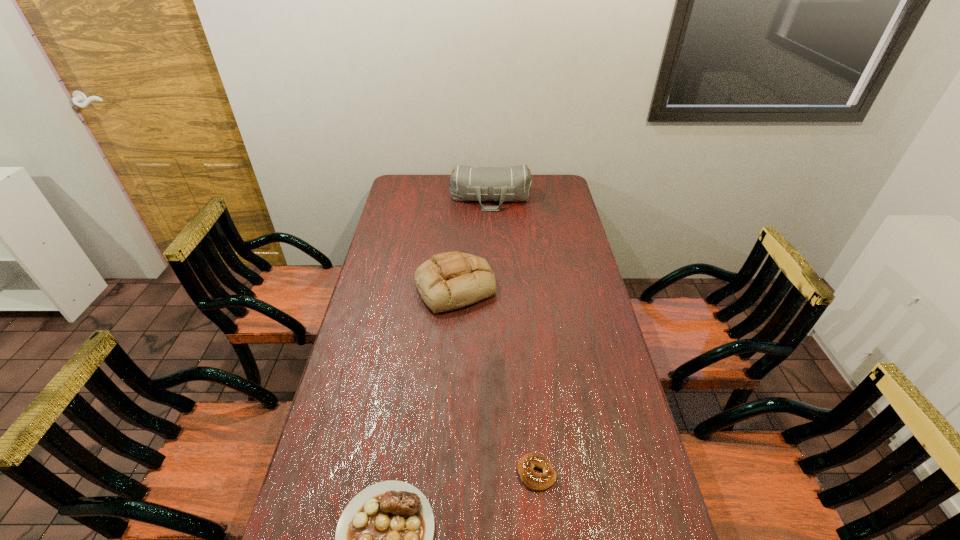
You are a GUI agent. You are given a task and a screenshot of the screen. Output one action in this format:
    pyautogui.click(x=<x>, y=<y>)
    Task: Click on the free region at the left edge
    
    Given the screenshot: What is the action you would take?
    pyautogui.click(x=393, y=309)

The image size is (960, 540). What are the coordinates of `vacant space at the right edge of the desktop` in the screenshot? It's located at (569, 260).

In the image, there is a desktop. Identify the location of vacant space at the far right corner. (555, 187).

Locate an element on the screen. This screenshot has height=540, width=960. free point between the duffel bag and the shortest object is located at coordinates (514, 336).

Where is `free space between the bread and the duffel bag`? The width and height of the screenshot is (960, 540). free space between the bread and the duffel bag is located at coordinates (473, 243).

At what (x,y) coordinates should I click in order to perform the action: click on vacant point located between the tallest object and the third nearest object. Please return your answer as a coordinate pair (x, y). The width and height of the screenshot is (960, 540). Looking at the image, I should click on (473, 243).

The height and width of the screenshot is (540, 960). What are the coordinates of `unoccupied position between the bagel and the farthest object` in the screenshot? It's located at (514, 336).

The width and height of the screenshot is (960, 540). What are the coordinates of `vacant region between the third shortest object and the farthest object` in the screenshot? It's located at (473, 243).

You are a GUI agent. You are given a task and a screenshot of the screen. Output one action in this format:
    pyautogui.click(x=<x>, y=<y>)
    Task: Click on the vacant point located between the shortest object and the tallest object
    Image resolution: width=960 pixels, height=540 pixels.
    Given the screenshot: What is the action you would take?
    pyautogui.click(x=514, y=336)

At what (x,y) coordinates should I click in order to perform the action: click on object that is the closest to the bagel. Please return your answer as a coordinate pair (x, y). This screenshot has width=960, height=540. Looking at the image, I should click on (384, 538).